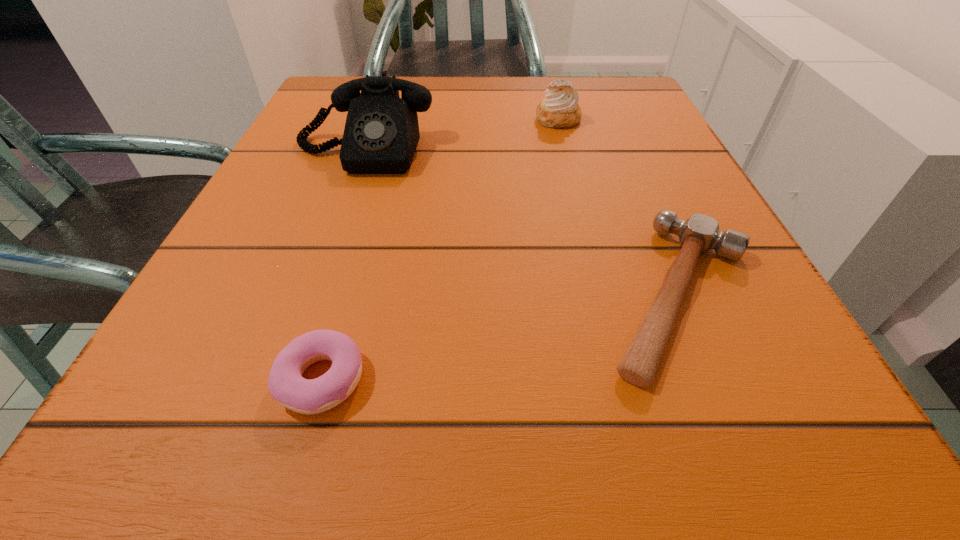
Find the location of a particular element. This screenshot has height=540, width=960. object located at the far edge is located at coordinates (560, 109).

This screenshot has width=960, height=540. Find the location of `object that is at the near edge`. object that is at the near edge is located at coordinates (287, 386).

Find the location of a particular element. This screenshot has width=960, height=540. telephone that is at the left edge is located at coordinates (381, 134).

What are the coordinates of `pastry that is at the left edge` in the screenshot? It's located at (287, 386).

You are a GUI agent. You are given a task and a screenshot of the screen. Output one action in this format:
    pyautogui.click(x=<x>, y=<y>)
    Task: Click on the pastry that is positioned at the right edge
    
    Given the screenshot: What is the action you would take?
    point(560,109)

Where is `hammer that is at the right edge`? hammer that is at the right edge is located at coordinates (699, 233).

Identify the location of object present at the near left corner. (287, 386).

Locate an element on the screen. object present at the far right corner is located at coordinates [560, 109].

The height and width of the screenshot is (540, 960). In the image, there is a desktop. In order to click on vacant space at the far edge in this screenshot , I will do `click(495, 97)`.

Find the location of a particular element. The image size is (960, 540). blank space at the near edge of the desktop is located at coordinates tap(297, 479).